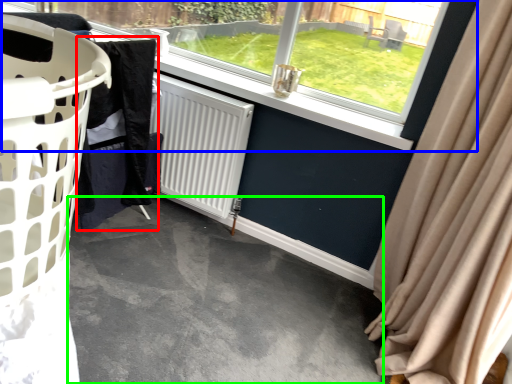
Question: Which is farther away from clothing (highlighted by a red box)? window (highlighted by a blue box) or concrete (highlighted by a green box)?

Choices:
 (A) window
 (B) concrete

Answer: (A)